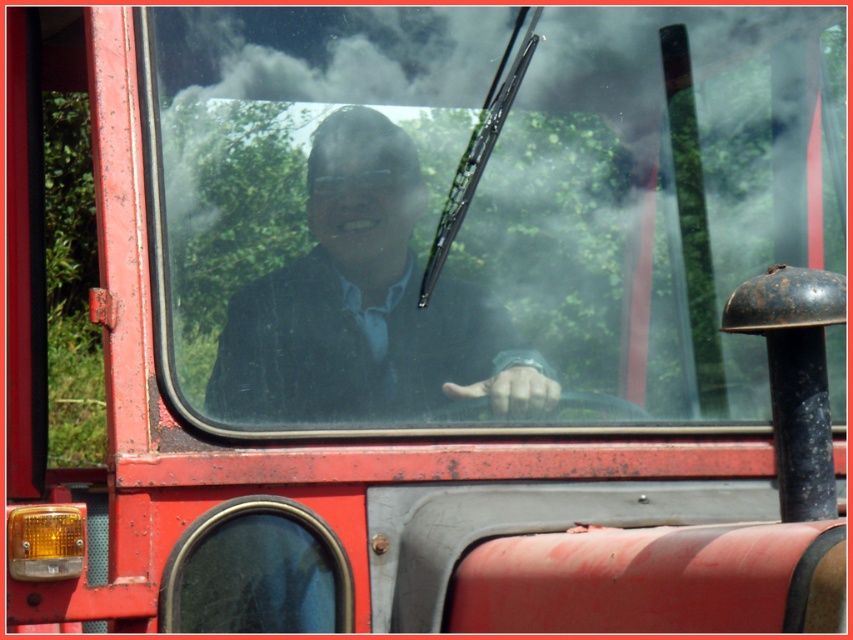
Question: Is clear glass windshield at center thinner than matte black suit at center?

Choices:
 (A) yes
 (B) no

Answer: (B)

Question: Among these points, which one is farthest from the camera?

Choices:
 (A) (785, 160)
 (B) (334, 390)

Answer: (A)

Question: Is clear glass windshield at center to the right of matte black suit at center from the viewer's perspective?

Choices:
 (A) yes
 (B) no

Answer: (A)

Question: Which point is closer to the camera?

Choices:
 (A) (416, 339)
 (B) (479, 236)

Answer: (A)

Question: Is clear glass windshield at center to the left of matte black suit at center from the viewer's perspective?

Choices:
 (A) yes
 (B) no

Answer: (B)